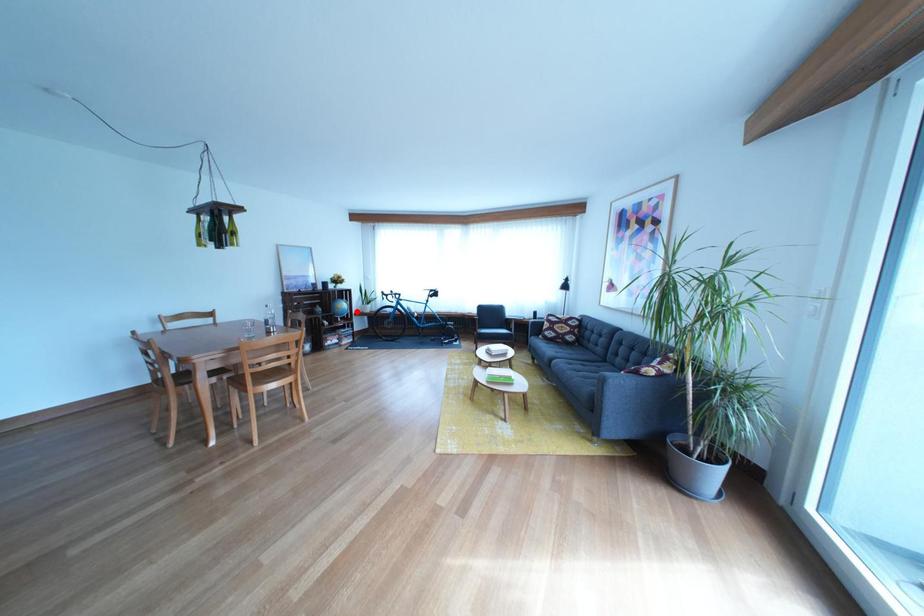
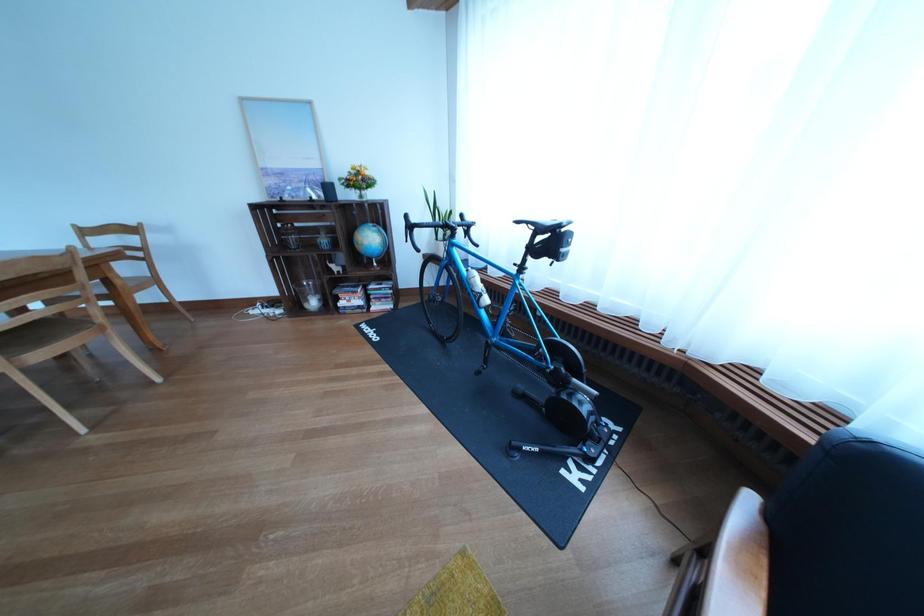
The point at the highlighted location is marked in the first image. Where is the corresponding point in the second image?

(383, 244)